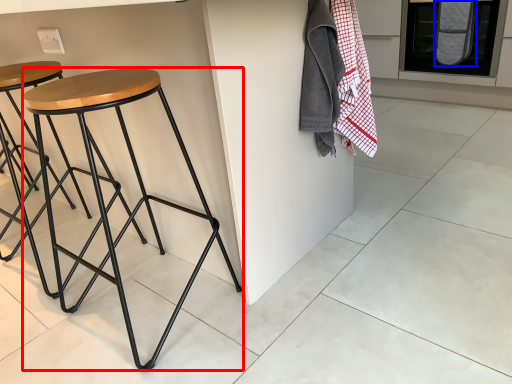
Question: Which object is further to the camera taking this photo, stool (highlighted by a red box) or blanket (highlighted by a blue box)?

Choices:
 (A) stool
 (B) blanket

Answer: (B)